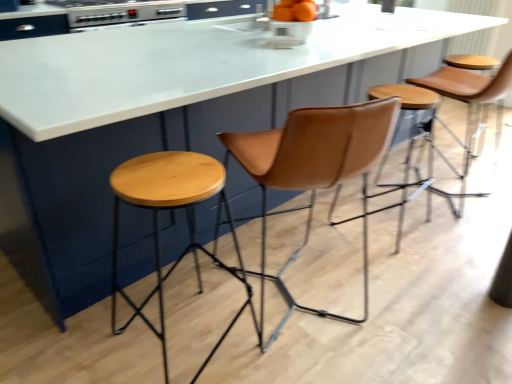
Where is `vacant area to the right of leather stool at center, which ranks as the 1th stool in right-to-left order`? vacant area to the right of leather stool at center, which ranks as the 1th stool in right-to-left order is located at coordinates (457, 230).